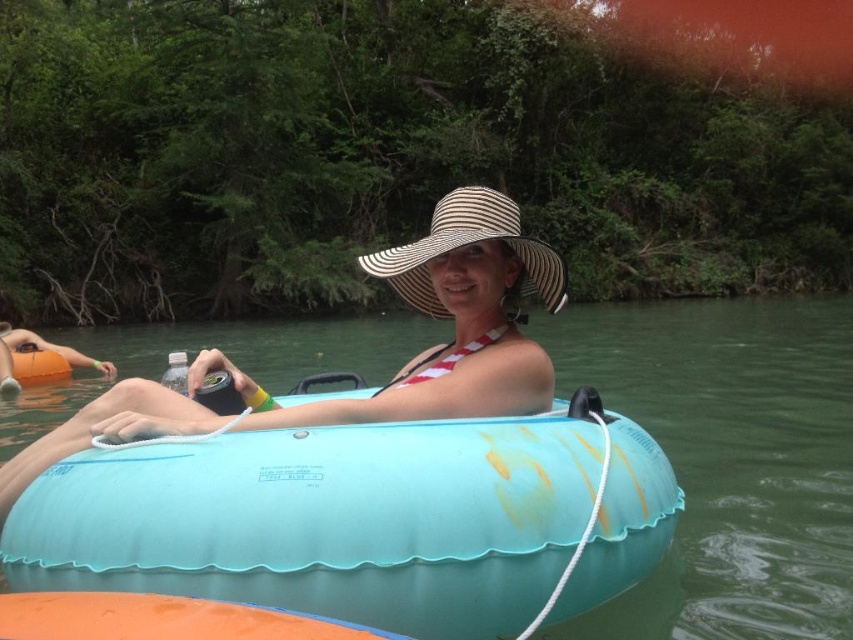
Is matte blue tube at center smaller than white striped straw hat at center?

Indeed, matte blue tube at center has a smaller size compared to white striped straw hat at center.

Is matte blue tube at center above white striped straw hat at center?

No.

Does point (219, 428) lie in front of point (460, 188)?

That is True.

Locate an element on the screen. matte blue tube at center is located at coordinates (395, 372).

Which of these two, light blue rubber ring at center or white striped straw hat at center, stands shorter?

light blue rubber ring at center is shorter.

Does light blue rubber ring at center appear under white striped straw hat at center?

Correct, light blue rubber ring at center is located below white striped straw hat at center.

In order to click on light blue rubber ring at center in this screenshot , I will do `click(361, 518)`.

Between point (314, 589) and point (471, 198), which one is positioned in front?

Point (314, 589) is in front.

Which is behind, point (157, 467) or point (438, 368)?

The point (438, 368) is more distant.

Does point (26, 579) lie behind point (521, 289)?

No, it is in front of (521, 289).

Find the location of a particular element. The image size is (853, 640). light blue rubber ring at center is located at coordinates (361, 518).